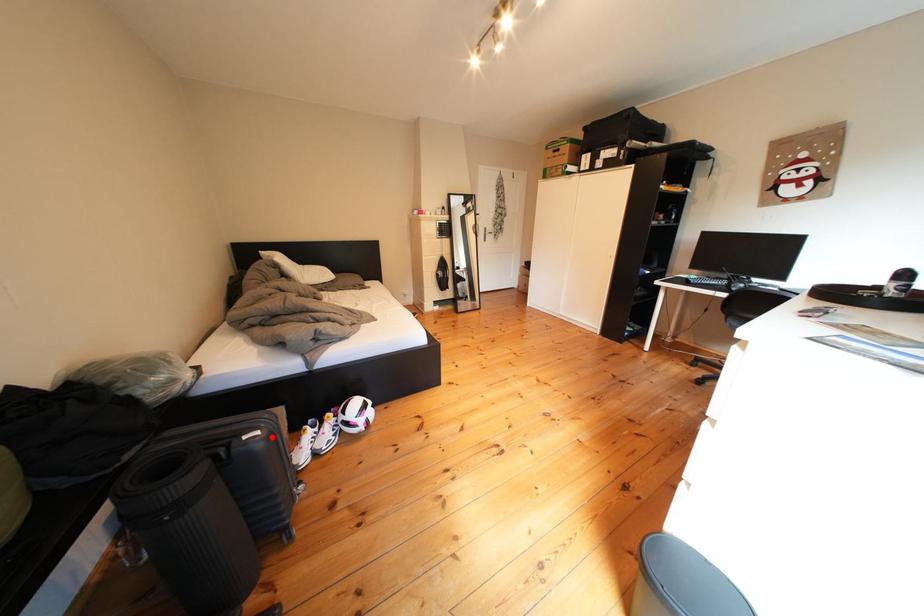
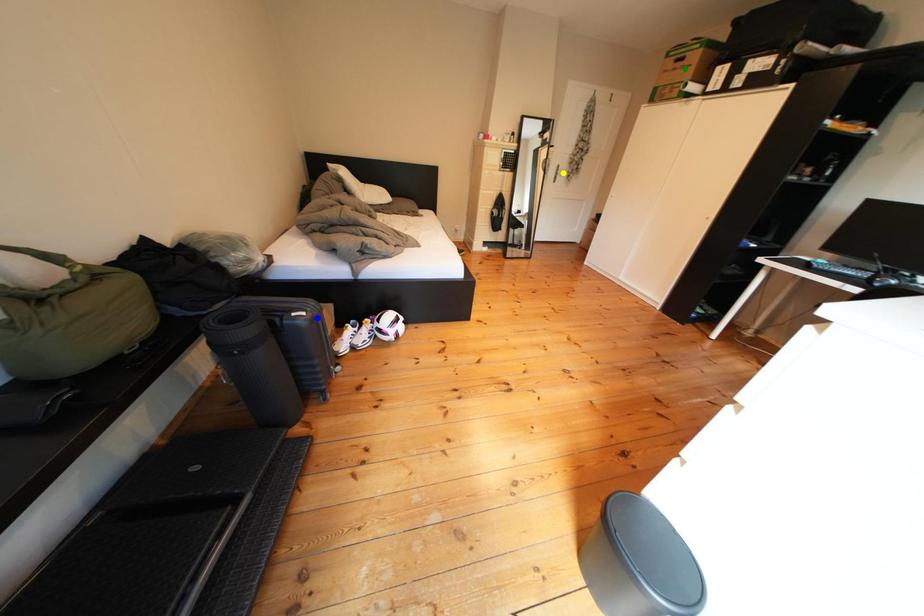
Question: I am providing you with two images of the same scene from different viewpoints. A red point is marked on the first image. You are given multiple points on the second image. In image 2, which mark is for the same physical point as the one in image 1?

Choices:
 (A) green point
 (B) blue point
 (C) yellow point

Answer: (B)